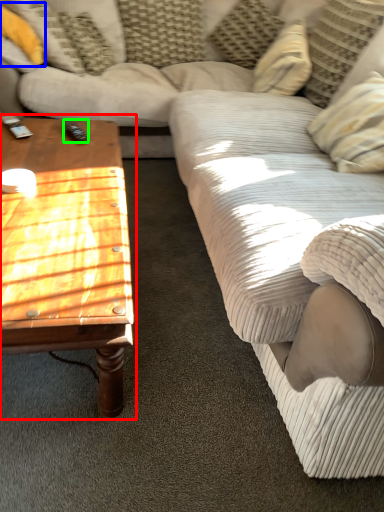
Question: Which is farther away from coffee table (highlighted by a red box)? pillow (highlighted by a blue box) or remote (highlighted by a green box)?

Choices:
 (A) pillow
 (B) remote

Answer: (A)